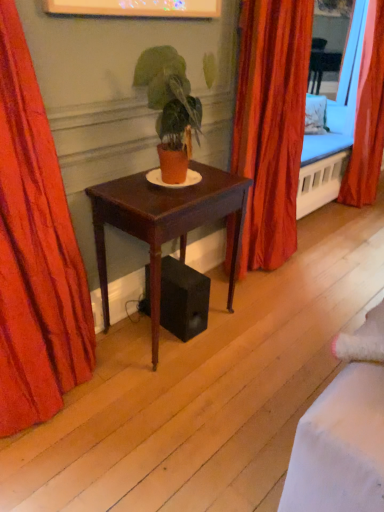
The height and width of the screenshot is (512, 384). Describe the element at coordinates (170, 108) in the screenshot. I see `matte orange pot at center` at that location.

This screenshot has height=512, width=384. What do you see at coordinates (367, 116) in the screenshot? I see `orange fabric curtain at right, the 1th curtain positioned from the back` at bounding box center [367, 116].

I want to click on velvet red curtain at left, placed as the 3th curtain when sorted from right to left, so click(35, 253).

How much space does silky orange curtain at center, which ranks as the second curtain in right-to-left order, occupy vertically?

silky orange curtain at center, which ranks as the second curtain in right-to-left order, is 4.74 feet in height.

Locate an element on the screen. This screenshot has height=512, width=384. silky orange curtain at center, which ranks as the second curtain in right-to-left order is located at coordinates (271, 125).

What are the coordinates of `matte orange pot at center` in the screenshot? It's located at (170, 108).

Based on the photo, based on their positions, is mahogany wood desk at center located to the left or right of matte orange pot at center?

From the image, it's evident that mahogany wood desk at center is to the left of matte orange pot at center.

Is mahogany wood desk at center inside or outside of matte orange pot at center?

mahogany wood desk at center is located beyond the bounds of matte orange pot at center.

Considering the sizes of mahogany wood desk at center and matte orange pot at center in the image, is mahogany wood desk at center bigger or smaller than matte orange pot at center?

mahogany wood desk at center is bigger than matte orange pot at center.

Is matte orange pot at center positioned beyond the bounds of velvet red curtain at left, the first curtain in the left-to-right sequence?

matte orange pot at center lies outside velvet red curtain at left, the first curtain in the left-to-right sequence,'s area.

From the image's perspective, between matte orange pot at center and velvet red curtain at left, the first curtain when ordered from front to back, which one is located above?

matte orange pot at center appears higher in the image.

Considering the relative sizes of matte orange pot at center and velvet red curtain at left, placed as the 3th curtain when sorted from right to left, in the image provided, is matte orange pot at center wider than velvet red curtain at left, placed as the 3th curtain when sorted from right to left,?

No.

From a real-world perspective, which curtain is the 2nd one underneath the matte orange pot at center? Please provide its 2D coordinates.

[(271, 125)]

From the image's perspective, who appears lower, matte orange pot at center or silky orange curtain at center, acting as the 2th curtain starting from the front?

matte orange pot at center appears lower in the image.

From the picture: Which is correct: matte orange pot at center is inside silky orange curtain at center, which ranks as the 2th curtain in back-to-front order, or outside of it?

matte orange pot at center is not enclosed by silky orange curtain at center, which ranks as the 2th curtain in back-to-front order.

Who is taller, matte orange pot at center or silky orange curtain at center, which ranks as the 2th curtain in back-to-front order?

silky orange curtain at center, which ranks as the 2th curtain in back-to-front order, is taller.

Would you consider velvet red curtain at left, the first curtain when ordered from front to back, to be distant from orange fabric curtain at right, placed as the third curtain when sorted from left to right?

Yes.

Is velvet red curtain at left, the first curtain when ordered from front to back, looking in the opposite direction of orange fabric curtain at right, arranged as the 1th curtain when viewed from the right?

No.

Considering their positions, is velvet red curtain at left, the first curtain in the left-to-right sequence, located in front of or behind orange fabric curtain at right, which ranks as the 3th curtain in front-to-back order?

Visually, velvet red curtain at left, the first curtain in the left-to-right sequence, is located in front of orange fabric curtain at right, which ranks as the 3th curtain in front-to-back order.

Who is taller, mahogany wood desk at center or orange fabric curtain at right, the 1th curtain positioned from the back?

With more height is orange fabric curtain at right, the 1th curtain positioned from the back.

Are mahogany wood desk at center and orange fabric curtain at right, the 1th curtain positioned from the back, far apart?

Indeed, mahogany wood desk at center is not near orange fabric curtain at right, the 1th curtain positioned from the back.

The height and width of the screenshot is (512, 384). I want to click on desk that appears on the left of orange fabric curtain at right, arranged as the 1th curtain when viewed from the right, so click(165, 224).

Is mahogany wood desk at center closer to the viewer compared to orange fabric curtain at right, arranged as the 1th curtain when viewed from the right?

Yes, it is.

Identify the location of the 2nd curtain behind the velvet red curtain at left, the first curtain in the left-to-right sequence, starting your count from the anchor. (367, 116).

From a real-world perspective, is orange fabric curtain at right, placed as the third curtain when sorted from left to right, over velvet red curtain at left, the third curtain in the back-to-front sequence?

Yes, from a real-world perspective, orange fabric curtain at right, placed as the third curtain when sorted from left to right, is on top of velvet red curtain at left, the third curtain in the back-to-front sequence.

In the scene shown: Is orange fabric curtain at right, the 1th curtain positioned from the back, at the left side of velvet red curtain at left, placed as the 3th curtain when sorted from right to left?

Incorrect, orange fabric curtain at right, the 1th curtain positioned from the back, is not on the left side of velvet red curtain at left, placed as the 3th curtain when sorted from right to left.

How much distance is there between orange fabric curtain at right, placed as the third curtain when sorted from left to right, and velvet red curtain at left, the third curtain in the back-to-front sequence?

orange fabric curtain at right, placed as the third curtain when sorted from left to right, is 2.73 meters from velvet red curtain at left, the third curtain in the back-to-front sequence.

Is silky orange curtain at center, which ranks as the second curtain in right-to-left order, completely or partially inside velvet red curtain at left, placed as the 3th curtain when sorted from right to left?

No, silky orange curtain at center, which ranks as the second curtain in right-to-left order, is not surrounded by velvet red curtain at left, placed as the 3th curtain when sorted from right to left.

Is velvet red curtain at left, placed as the 3th curtain when sorted from right to left, to the left or to the right of silky orange curtain at center, which appears as the 2th curtain when viewed from the left, in the image?

velvet red curtain at left, placed as the 3th curtain when sorted from right to left, is positioned on silky orange curtain at center, which appears as the 2th curtain when viewed from the left,'s left side.

Image resolution: width=384 pixels, height=512 pixels. Find the location of `curtain that appears below the silky orange curtain at center, acting as the 2th curtain starting from the front (from the image's perspective)`. curtain that appears below the silky orange curtain at center, acting as the 2th curtain starting from the front (from the image's perspective) is located at coordinates (35, 253).

Would you consider velvet red curtain at left, placed as the 3th curtain when sorted from right to left, to be distant from silky orange curtain at center, which ranks as the second curtain in right-to-left order?

That's right, there is a large distance between velvet red curtain at left, placed as the 3th curtain when sorted from right to left, and silky orange curtain at center, which ranks as the second curtain in right-to-left order.

At what (x,y) coordinates should I click in order to perform the action: click on desk on the left of matte orange pot at center. Please return your answer as a coordinate pair (x, y). Image resolution: width=384 pixels, height=512 pixels. Looking at the image, I should click on (165, 224).

Image resolution: width=384 pixels, height=512 pixels. Find the location of `curtain that appears below the matte orange pot at center (from the image's perspective)`. curtain that appears below the matte orange pot at center (from the image's perspective) is located at coordinates (35, 253).

Based on their spatial positions, is silky orange curtain at center, acting as the 2th curtain starting from the front, or matte orange pot at center further from velvet red curtain at left, the third curtain in the back-to-front sequence?

Based on the image, silky orange curtain at center, acting as the 2th curtain starting from the front, appears to be further to velvet red curtain at left, the third curtain in the back-to-front sequence.

Estimate the real-world distances between objects in this image. Which object is closer to velvet red curtain at left, the third curtain in the back-to-front sequence, orange fabric curtain at right, arranged as the 1th curtain when viewed from the right, or matte orange pot at center?

matte orange pot at center is positioned closer to the anchor velvet red curtain at left, the third curtain in the back-to-front sequence.

When comparing their distances from mahogany wood desk at center, does orange fabric curtain at right, the 1th curtain positioned from the back, or silky orange curtain at center, which appears as the 2th curtain when viewed from the left, seem closer?

Based on the image, silky orange curtain at center, which appears as the 2th curtain when viewed from the left, appears to be nearer to mahogany wood desk at center.

Which object lies nearer to the anchor point velvet red curtain at left, the third curtain in the back-to-front sequence, matte orange pot at center or mahogany wood desk at center?

mahogany wood desk at center is positioned closer to the anchor velvet red curtain at left, the third curtain in the back-to-front sequence.

Which object lies further to the anchor point mahogany wood desk at center, silky orange curtain at center, which appears as the 2th curtain when viewed from the left, or velvet red curtain at left, the first curtain in the left-to-right sequence?

Based on the image, silky orange curtain at center, which appears as the 2th curtain when viewed from the left, appears to be further to mahogany wood desk at center.

Looking at this image, considering their positions, is orange fabric curtain at right, placed as the third curtain when sorted from left to right, positioned further to silky orange curtain at center, which appears as the 2th curtain when viewed from the left, than velvet red curtain at left, placed as the 3th curtain when sorted from right to left?

orange fabric curtain at right, placed as the third curtain when sorted from left to right, is positioned further to the anchor silky orange curtain at center, which appears as the 2th curtain when viewed from the left.

Looking at the image, which one is located closer to velvet red curtain at left, placed as the 3th curtain when sorted from right to left, silky orange curtain at center, which ranks as the 2th curtain in back-to-front order, or orange fabric curtain at right, which ranks as the 3th curtain in front-to-back order?

silky orange curtain at center, which ranks as the 2th curtain in back-to-front order, is positioned closer to the anchor velvet red curtain at left, placed as the 3th curtain when sorted from right to left.

Looking at this image, estimate the real-world distances between objects in this image. Which object is further from orange fabric curtain at right, the 1th curtain positioned from the back, velvet red curtain at left, the first curtain when ordered from front to back, or mahogany wood desk at center?

The object further to orange fabric curtain at right, the 1th curtain positioned from the back, is velvet red curtain at left, the first curtain when ordered from front to back.

Identify the location of curtain located between matte orange pot at center and orange fabric curtain at right, arranged as the 1th curtain when viewed from the right, in the left-right direction. This screenshot has height=512, width=384. (271, 125).

At what (x,y) coordinates should I click in order to perform the action: click on houseplant between mahogany wood desk at center and orange fabric curtain at right, placed as the third curtain when sorted from left to right, from left to right. Please return your answer as a coordinate pair (x, y). Image resolution: width=384 pixels, height=512 pixels. Looking at the image, I should click on (170, 108).

I want to click on curtain situated between mahogany wood desk at center and orange fabric curtain at right, placed as the third curtain when sorted from left to right, from left to right, so click(x=271, y=125).

You are a GUI agent. You are given a task and a screenshot of the screen. Output one action in this format:
    pyautogui.click(x=<x>, y=<y>)
    Task: Click on the desk located between velvet red curtain at left, the first curtain in the left-to-right sequence, and orange fabric curtain at right, which ranks as the 3th curtain in front-to-back order, in the left-right direction
    
    Given the screenshot: What is the action you would take?
    pyautogui.click(x=165, y=224)